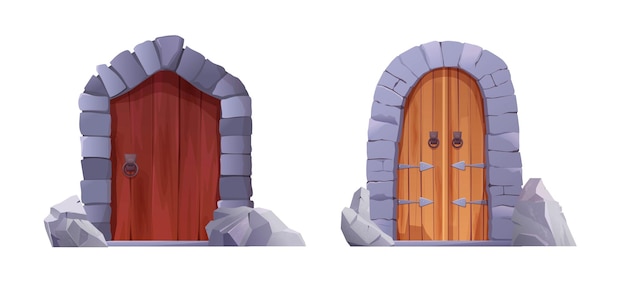
Where is `tand double door`? Image resolution: width=626 pixels, height=294 pixels. tand double door is located at coordinates (418, 110), (461, 109).